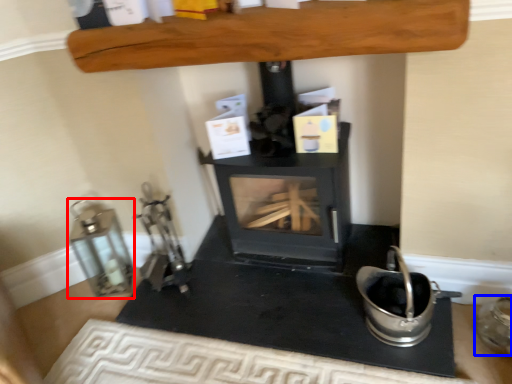
Question: Which object appears farthest to the camera in this image, appliance (highlighted by a red box) or appliance (highlighted by a blue box)?

Choices:
 (A) appliance
 (B) appliance

Answer: (A)